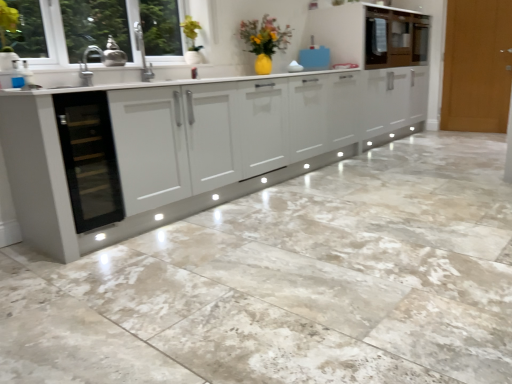
Where is `light brown wooden door at right`? Image resolution: width=512 pixels, height=384 pixels. light brown wooden door at right is located at coordinates (477, 66).

What do you see at coordinates (395, 38) in the screenshot?
I see `glossy white cabinet at upper right, which is the second cabinetry in left-to-right order` at bounding box center [395, 38].

I want to click on glossy white cabinet at upper right, which ranks as the 1th cabinetry in right-to-left order, so click(395, 38).

What do you see at coordinates (89, 159) in the screenshot? The image size is (512, 384). I see `transparent glass wine cooler at left` at bounding box center [89, 159].

At what (x,y) coordinates should I click in order to perform the action: click on blue plastic bag at upper center, acting as the second appliance starting from the front. Please return your answer as a coordinate pair (x, y). The image size is (512, 384). Looking at the image, I should click on (314, 57).

Considering the relative positions of transparent glass wine cooler at left and clear glass window at upper left in the image provided, is transparent glass wine cooler at left in front of clear glass window at upper left?

Yes, transparent glass wine cooler at left is in front of clear glass window at upper left.

From a real-world perspective, does transparent glass wine cooler at left sit lower than clear glass window at upper left?

Yes, from a real-world perspective, transparent glass wine cooler at left is beneath clear glass window at upper left.

Which of these two, glossy white cabinet at upper center, arranged as the second cabinetry when viewed from the right, or transparent glass wine cooler at left, is smaller?

transparent glass wine cooler at left is smaller.

Looking at their sizes, would you say glossy white cabinet at upper center, which is the first cabinetry from left to right, is wider or thinner than transparent glass wine cooler at left?

In the image, glossy white cabinet at upper center, which is the first cabinetry from left to right, appears to be wider than transparent glass wine cooler at left.

Which of these two, glossy white cabinet at upper center, arranged as the second cabinetry when viewed from the right, or light brown wooden door at right, is bigger?

With larger size is glossy white cabinet at upper center, arranged as the second cabinetry when viewed from the right.

From the image's perspective, is glossy white cabinet at upper center, arranged as the second cabinetry when viewed from the right, located above light brown wooden door at right?

Correct, glossy white cabinet at upper center, arranged as the second cabinetry when viewed from the right, appears higher than light brown wooden door at right in the image.

Is glossy white cabinet at upper center, which is the first cabinetry from left to right, next to light brown wooden door at right and touching it?

glossy white cabinet at upper center, which is the first cabinetry from left to right, is not next to light brown wooden door at right, and they're not touching.

Which is behind, point (317, 21) or point (457, 66)?

Positioned behind is point (457, 66).

Is clear glass window at upper left shorter than light brown wooden door at right?

Correct, clear glass window at upper left is not as tall as light brown wooden door at right.

From the image's perspective, is clear glass window at upper left located above or below light brown wooden door at right?

Clearly, from the image's perspective, clear glass window at upper left is below light brown wooden door at right.

Which of these two, clear glass window at upper left or light brown wooden door at right, is bigger?

Bigger between the two is light brown wooden door at right.

The width and height of the screenshot is (512, 384). Identify the location of window frame below the light brown wooden door at right (from the image's perspective). (37, 30).

Based on their sizes in the image, would you say metallic brass teapot at upper left, the 2th appliance viewed from the back, is bigger or smaller than clear glass window at upper left?

metallic brass teapot at upper left, the 2th appliance viewed from the back, is smaller than clear glass window at upper left.

Consider the image. From a real-world perspective, who is located lower, metallic brass teapot at upper left, which is the 1th appliance in bottom-to-top order, or clear glass window at upper left?

From a 3D spatial view, metallic brass teapot at upper left, which is the 1th appliance in bottom-to-top order, is below.

From the image's perspective, is metallic brass teapot at upper left, which is the first appliance in left-to-right order, below clear glass window at upper left?

No, from the image's perspective, metallic brass teapot at upper left, which is the first appliance in left-to-right order, is not beneath clear glass window at upper left.

Is point (115, 55) positioned in front of point (50, 35)?

No, (115, 55) is behind (50, 35).

Which of these two, light brown wooden door at right or clear glass window at upper left, stands taller?

Standing taller between the two is light brown wooden door at right.

From a real-world perspective, is light brown wooden door at right beneath clear glass window at upper left?

Indeed, from a real-world perspective, light brown wooden door at right is positioned beneath clear glass window at upper left.

From the image's perspective, is light brown wooden door at right over clear glass window at upper left?

Yes, from the image's perspective, light brown wooden door at right is on top of clear glass window at upper left.

Considering the relative sizes of light brown wooden door at right and clear glass window at upper left in the image provided, is light brown wooden door at right smaller than clear glass window at upper left?

Incorrect, light brown wooden door at right is not smaller in size than clear glass window at upper left.

From a real-world perspective, is light brown wooden door at right positioned above or below glossy white cabinet at upper center, arranged as the second cabinetry when viewed from the right?

In terms of real-world spatial position, light brown wooden door at right is below glossy white cabinet at upper center, arranged as the second cabinetry when viewed from the right.

I want to click on door lying on the right of glossy white cabinet at upper center, arranged as the second cabinetry when viewed from the right, so click(477, 66).

In the scene shown: Considering the relative positions of light brown wooden door at right and glossy white cabinet at upper center, arranged as the second cabinetry when viewed from the right, in the image provided, is light brown wooden door at right to the left of glossy white cabinet at upper center, arranged as the second cabinetry when viewed from the right, from the viewer's perspective?

No.

Is point (483, 29) closer to viewer compared to point (402, 49)?

That is False.

The height and width of the screenshot is (384, 512). What are the coordinates of `window frame above the transparent glass wine cooler at left (from a real-world perspective)` in the screenshot? It's located at (37, 30).

Locate an element on the screen. The image size is (512, 384). dish washer below the glossy white cabinet at upper center, which is the first cabinetry from left to right (from a real-world perspective) is located at coordinates (89, 159).

Looking at the image, which one is located closer to light brown wooden door at right, glossy white cabinet at upper right, which is the second cabinetry in left-to-right order, or blue plastic bag at upper center, acting as the 2th appliance starting from the left?

glossy white cabinet at upper right, which is the second cabinetry in left-to-right order, is closer to light brown wooden door at right.

Considering their positions, is transparent glass wine cooler at left positioned further to glossy white cabinet at upper center, arranged as the second cabinetry when viewed from the right, than clear glass window at upper left?

transparent glass wine cooler at left lies further to glossy white cabinet at upper center, arranged as the second cabinetry when viewed from the right, than the other object.

Which object lies nearer to the anchor point metallic brass teapot at upper left, the 2th appliance positioned from the top, light brown wooden door at right or glossy white cabinet at upper center, arranged as the second cabinetry when viewed from the right?

glossy white cabinet at upper center, arranged as the second cabinetry when viewed from the right, lies closer to metallic brass teapot at upper left, the 2th appliance positioned from the top, than the other object.

Estimate the real-world distances between objects in this image. Which object is closer to clear glass window at upper left, glossy white cabinet at upper right, which ranks as the 1th cabinetry in right-to-left order, or transparent glass wine cooler at left?

transparent glass wine cooler at left lies closer to clear glass window at upper left than the other object.

Based on their spatial positions, is metallic brass teapot at upper left, which is the first appliance in front-to-back order, or glossy white cabinet at upper center, which is the first cabinetry from left to right, further from clear glass window at upper left?

The object further to clear glass window at upper left is glossy white cabinet at upper center, which is the first cabinetry from left to right.

Which object lies further to the anchor point glossy white cabinet at upper center, arranged as the second cabinetry when viewed from the right, blue plastic bag at upper center, acting as the second appliance starting from the front, or transparent glass wine cooler at left?

transparent glass wine cooler at left is further to glossy white cabinet at upper center, arranged as the second cabinetry when viewed from the right.

Which object lies further to the anchor point blue plastic bag at upper center, arranged as the 1th appliance when viewed from the back, metallic brass teapot at upper left, the 2th appliance viewed from the back, or clear glass window at upper left?

Answer: The object further to blue plastic bag at upper center, arranged as the 1th appliance when viewed from the back, is clear glass window at upper left.

When comparing their distances from light brown wooden door at right, does metallic brass teapot at upper left, the 2th appliance viewed from the back, or clear glass window at upper left seem further?

Based on the image, clear glass window at upper left appears to be further to light brown wooden door at right.

This screenshot has width=512, height=384. What are the coordinates of `appliance between metallic brass teapot at upper left, which is the first appliance in front-to-back order, and glossy white cabinet at upper right, which ranks as the 1th cabinetry in right-to-left order, from left to right` in the screenshot? It's located at (314, 57).

Locate an element on the screen. cabinetry between clear glass window at upper left and glossy white cabinet at upper right, which is the second cabinetry in left-to-right order, from left to right is located at coordinates (372, 35).

Identify the location of cabinetry between glossy white cabinet at upper center, arranged as the second cabinetry when viewed from the right, and light brown wooden door at right from left to right. (395, 38).

What are the coordinates of `dish washer between clear glass window at upper left and glossy white cabinet at upper right, which ranks as the 1th cabinetry in right-to-left order, in the horizontal direction` in the screenshot? It's located at (89, 159).